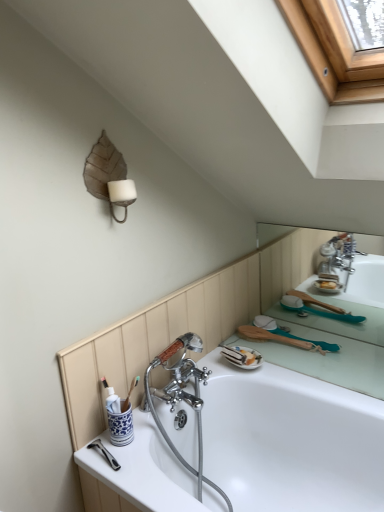
The height and width of the screenshot is (512, 384). Describe the element at coordinates (290, 440) in the screenshot. I see `white glossy bathtub at center` at that location.

At what (x,y) coordinates should I click in order to perform the action: click on white glossy bathtub at center. Please return your answer as a coordinate pair (x, y). Looking at the image, I should click on (290, 440).

The image size is (384, 512). Describe the element at coordinates (108, 176) in the screenshot. I see `burlap leaf at upper left` at that location.

The image size is (384, 512). I want to click on burlap leaf at upper left, so click(108, 176).

The image size is (384, 512). What are the coordinates of `white glossy bathtub at center` in the screenshot? It's located at (290, 440).

Which object is positioned more to the right, white glossy bathtub at center or burlap leaf at upper left?

white glossy bathtub at center is more to the right.

Which object is closer to the camera taking this photo, white glossy bathtub at center or burlap leaf at upper left?

white glossy bathtub at center is closer to the camera.

Considering the points (241, 456) and (111, 184), which point is in front, point (241, 456) or point (111, 184)?

Point (111, 184)

From the image's perspective, does white glossy bathtub at center appear lower than burlap leaf at upper left?

Indeed, from the image's perspective, white glossy bathtub at center is shown beneath burlap leaf at upper left.

From a real-world perspective, is white glossy bathtub at center located higher than burlap leaf at upper left?

Answer: No.

In the scene shown: Considering the sizes of objects white glossy bathtub at center and burlap leaf at upper left in the image provided, who is wider, white glossy bathtub at center or burlap leaf at upper left?

white glossy bathtub at center.

Considering the sizes of objects white glossy bathtub at center and burlap leaf at upper left in the image provided, who is shorter, white glossy bathtub at center or burlap leaf at upper left?

burlap leaf at upper left.

Can you confirm if white glossy bathtub at center is bigger than burlap leaf at upper left?

Yes.

Would you say white glossy bathtub at center is inside or outside burlap leaf at upper left?

white glossy bathtub at center exists outside the volume of burlap leaf at upper left.

Is white glossy bathtub at center far from burlap leaf at upper left?

No, white glossy bathtub at center is not far from burlap leaf at upper left.

Does white glossy bathtub at center turn towards burlap leaf at upper left?

No, white glossy bathtub at center is not facing towards burlap leaf at upper left.

From the picture: How different are the orientations of white glossy bathtub at center and burlap leaf at upper left in degrees?

white glossy bathtub at center and burlap leaf at upper left are facing 92 degrees away from each other.

How far apart are white glossy bathtub at center and burlap leaf at upper left?

They are 85.35 centimeters apart.

Image resolution: width=384 pixels, height=512 pixels. I want to click on bathtub on the right side of burlap leaf at upper left, so click(x=290, y=440).

Based on their positions, is burlap leaf at upper left located to the left or right of white glossy bathtub at center?

Based on their positions, burlap leaf at upper left is located to the left of white glossy bathtub at center.

Is burlap leaf at upper left positioned before white glossy bathtub at center?

No, burlap leaf at upper left is further to the viewer.

Which point is more distant from viewer, (122,159) or (264,399)?

The point (264,399) is behind.

From the image's perspective, which object appears higher, burlap leaf at upper left or white glossy bathtub at center?

burlap leaf at upper left, from the image's perspective.

In the scene shown: From a real-world perspective, which is physically above, burlap leaf at upper left or white glossy bathtub at center?

burlap leaf at upper left is physically above.

Considering the sizes of objects burlap leaf at upper left and white glossy bathtub at center in the image provided, who is thinner, burlap leaf at upper left or white glossy bathtub at center?

burlap leaf at upper left.

Can you confirm if burlap leaf at upper left is shorter than white glossy bathtub at center?

Indeed, burlap leaf at upper left has a lesser height compared to white glossy bathtub at center.

Looking at this image, who is bigger, burlap leaf at upper left or white glossy bathtub at center?

With larger size is white glossy bathtub at center.

From the picture: Is burlap leaf at upper left located outside white glossy bathtub at center?

That's correct, burlap leaf at upper left is outside of white glossy bathtub at center.

Is burlap leaf at upper left with white glossy bathtub at center?

No, burlap leaf at upper left is not making contact with white glossy bathtub at center.

Is burlap leaf at upper left oriented away from white glossy bathtub at center?

That's not correct — burlap leaf at upper left is not looking away from white glossy bathtub at center.

Can you tell me how much burlap leaf at upper left and white glossy bathtub at center differ in facing direction?

There is a 92-degree angle between the facing directions of burlap leaf at upper left and white glossy bathtub at center.

How far apart are burlap leaf at upper left and white glossy bathtub at center?

They are 85.35 centimeters apart.

The image size is (384, 512). I want to click on lamp that appears behind the white glossy bathtub at center, so click(108, 176).

Where is `bathtub on the right of burlap leaf at upper left`? Image resolution: width=384 pixels, height=512 pixels. bathtub on the right of burlap leaf at upper left is located at coordinates (290, 440).

Where is `lamp above the white glossy bathtub at center (from the image's perspective)`? This screenshot has height=512, width=384. lamp above the white glossy bathtub at center (from the image's perspective) is located at coordinates (108, 176).